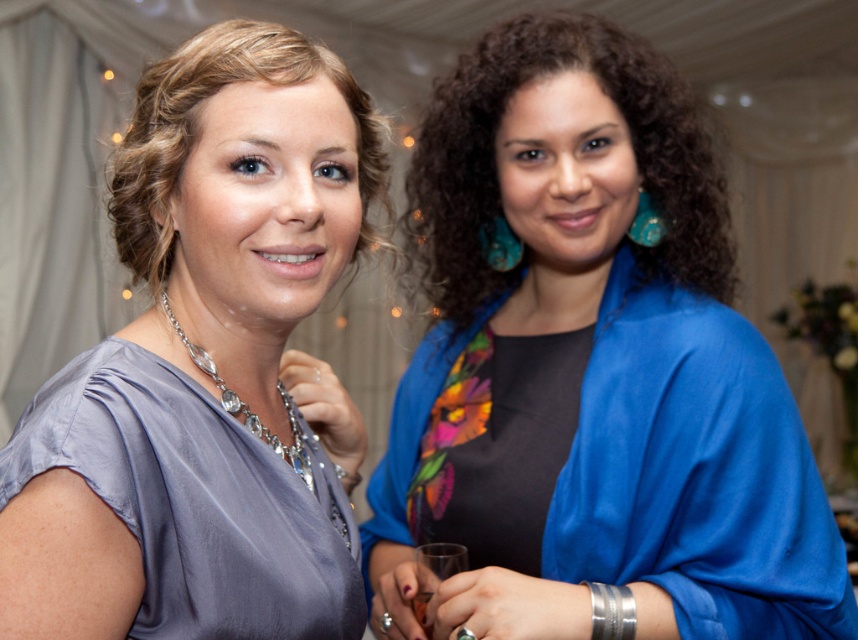
Locate an element on the screen. satin dress at left is located at coordinates (196, 500).

Which is above, satin dress at left or glossy plastic wine glass at center?

Positioned higher is satin dress at left.

This screenshot has height=640, width=858. What are the coordinates of `satin dress at left` in the screenshot? It's located at (196, 500).

This screenshot has height=640, width=858. In order to click on satin dress at left in this screenshot , I will do `click(196, 500)`.

Which is behind, point (506, 512) or point (273, 449)?

The point (506, 512) is more distant.

Is point (554, 545) less distant than point (298, 636)?

That is False.

Locate an element on the screen. blue satin kimono at center is located at coordinates (591, 371).

Which of these two, satin gray blouse at upper left or clear glass wine glass at lower center, stands shorter?

clear glass wine glass at lower center

Is satin gray blouse at upper left thinner than clear glass wine glass at lower center?

In fact, satin gray blouse at upper left might be wider than clear glass wine glass at lower center.

You are a GUI agent. You are given a task and a screenshot of the screen. Output one action in this format:
    pyautogui.click(x=<x>, y=<y>)
    Task: Click on the satin gray blouse at upper left
    
    Given the screenshot: What is the action you would take?
    pyautogui.click(x=207, y=369)

The image size is (858, 640). Identify the location of satin gray blouse at upper left. (207, 369).